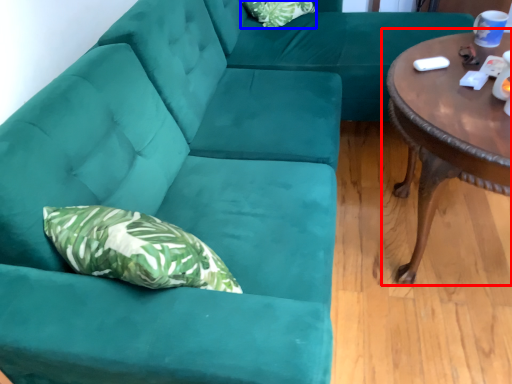
Question: Which point is further to the camera, coffee table (highlighted by a red box) or pillow (highlighted by a blue box)?

Choices:
 (A) coffee table
 (B) pillow

Answer: (B)